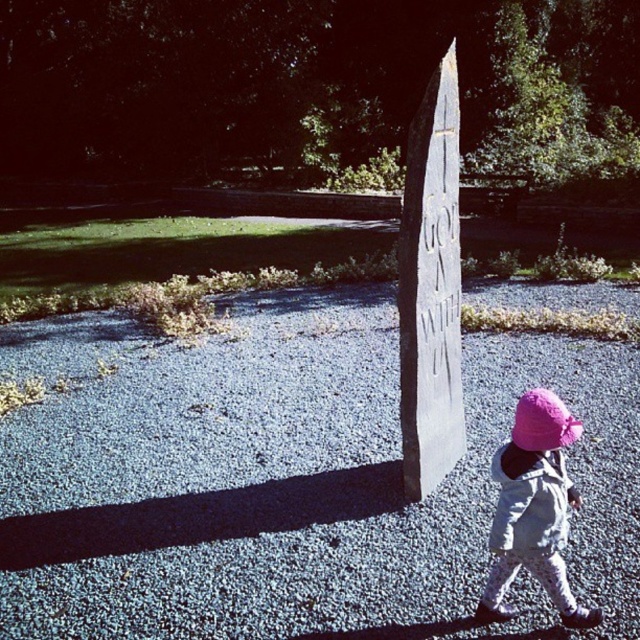
You are a photographer trying to capture the gray gravel at center and the pink fabric hat at lower right in the same frame. Based on their positions, which object is closer to the camera?

The pink fabric hat at lower right is closer to the camera because it is positioned above the gray gravel at center, which is below it.

You are a photographer trying to capture the gray gravel at center and the pink fabric hat at lower right in the same frame. Which object should you focus on first if you want to ensure both are in focus?

The gray gravel at center is shorter than the pink fabric hat at lower right, so you should focus on the pink fabric hat at lower right first to ensure both are in focus since it is closer to the camera.